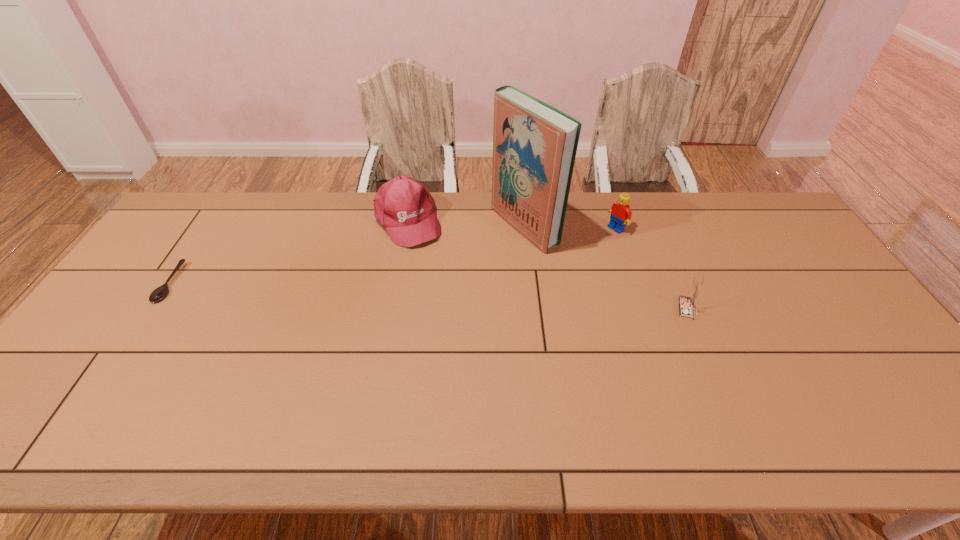
At what (x,y) coordinates should I click in order to perform the action: click on Lego that is at the far edge. Please return your answer as a coordinate pair (x, y). This screenshot has width=960, height=540. Looking at the image, I should click on click(x=620, y=214).

Find the location of a particular element. This screenshot has width=960, height=540. object that is at the left edge is located at coordinates (160, 292).

This screenshot has height=540, width=960. Find the location of `blank area at the far edge`. blank area at the far edge is located at coordinates (318, 202).

At what (x,y) coordinates should I click in order to perform the action: click on vacant space at the left edge of the desktop. Please return your answer as a coordinate pair (x, y). Looking at the image, I should click on (93, 338).

The width and height of the screenshot is (960, 540). In the image, there is a desktop. Find the location of `vacant space at the right edge`. vacant space at the right edge is located at coordinates (786, 284).

Find the location of a particular element. Image resolution: width=960 pixels, height=540 pixels. vacant space at the far right corner of the desktop is located at coordinates (778, 218).

Find the location of a particular element. free spot between the second object from left to right and the shortest object is located at coordinates (288, 252).

Identify the location of free spot between the baseball cap and the rightmost object. (546, 265).

The height and width of the screenshot is (540, 960). I want to click on unoccupied area between the baseball cap and the soupspoon, so click(x=288, y=252).

The width and height of the screenshot is (960, 540). What are the coordinates of `empty location between the matchbox and the shortest object` in the screenshot? It's located at (427, 296).